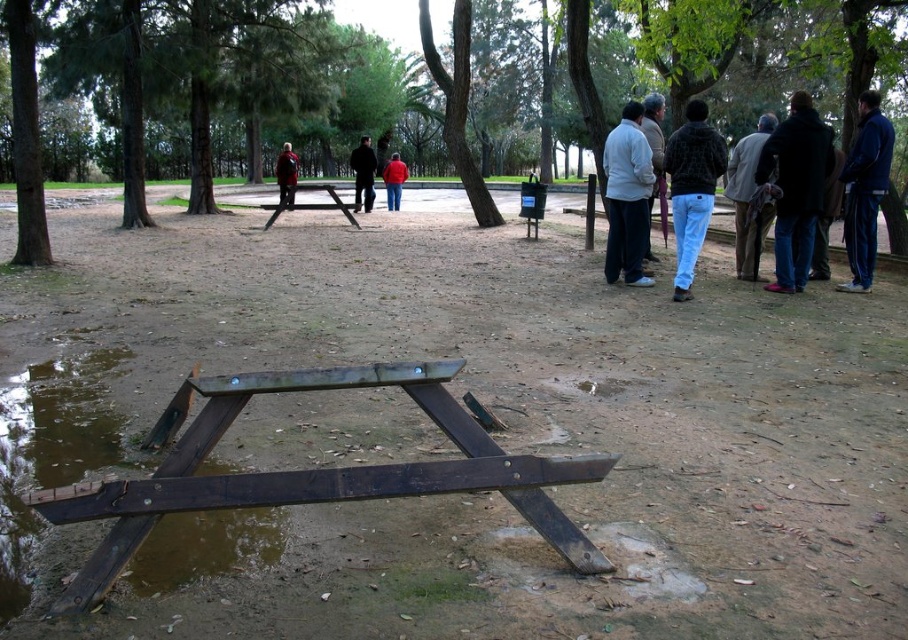
Question: Does brown wood tree at center come in front of dark gray wool coat at right?

Choices:
 (A) yes
 (B) no

Answer: (B)

Question: Which point is closer to the camera?

Choices:
 (A) blue track suit at right
 (B) white matte shirt at center

Answer: (A)

Question: Can you confirm if blue track suit at right is wider than matte black jacket at center?

Choices:
 (A) no
 (B) yes

Answer: (A)

Question: Among these points, which one is nearest to the camera?

Choices:
 (A) (456, 168)
 (B) (752, 172)
 (C) (856, 252)
 (D) (798, 256)

Answer: (D)

Question: Can you confirm if black fuzzy jacket at right is positioned to the right of red matte jacket at center?

Choices:
 (A) yes
 (B) no

Answer: (A)

Question: Estimate the real-world distances between objects in this image. Which object is closer to the dark brown leather jacket at center?

Choices:
 (A) blue track suit at right
 (B) dark blue jacket at right

Answer: (B)